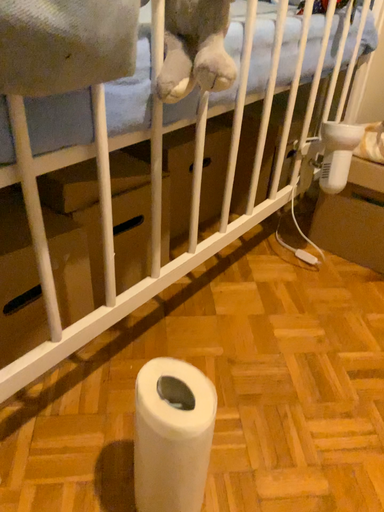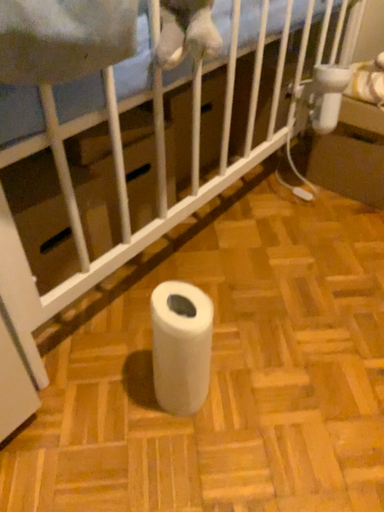
Question: Which way did the camera rotate in the video?

Choices:
 (A) rotated upward
 (B) rotated downward

Answer: (B)